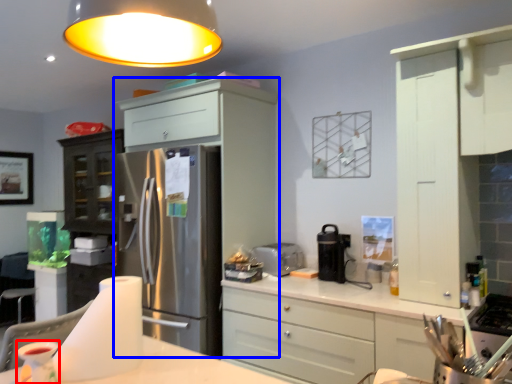
Question: Which point is further to the camera, appliance (highlighted by a red box) or cabinetry (highlighted by a blue box)?

Choices:
 (A) appliance
 (B) cabinetry

Answer: (B)